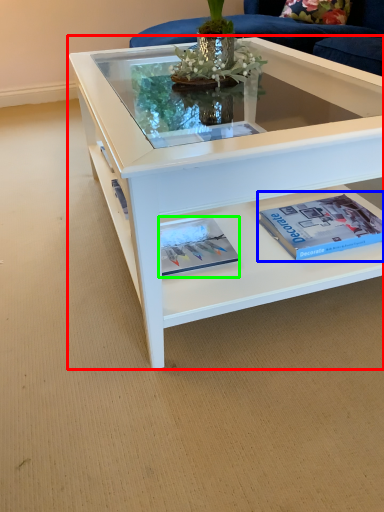
Question: Which object is the closest to the coffee table (highlighted by a red box)? Choose among these: paperback book (highlighted by a blue box) or magazine (highlighted by a green box).

Choices:
 (A) paperback book
 (B) magazine

Answer: (A)